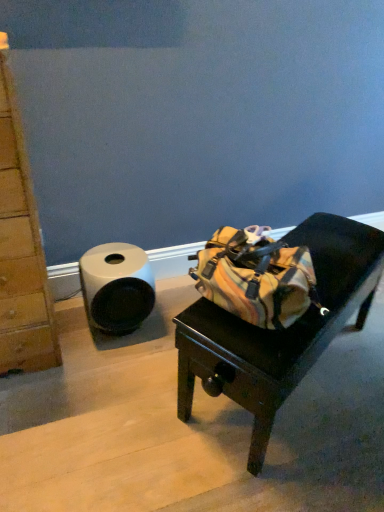
This screenshot has height=512, width=384. Find the location of `free region on the left part of white matte toilet paper at left`. free region on the left part of white matte toilet paper at left is located at coordinates (69, 325).